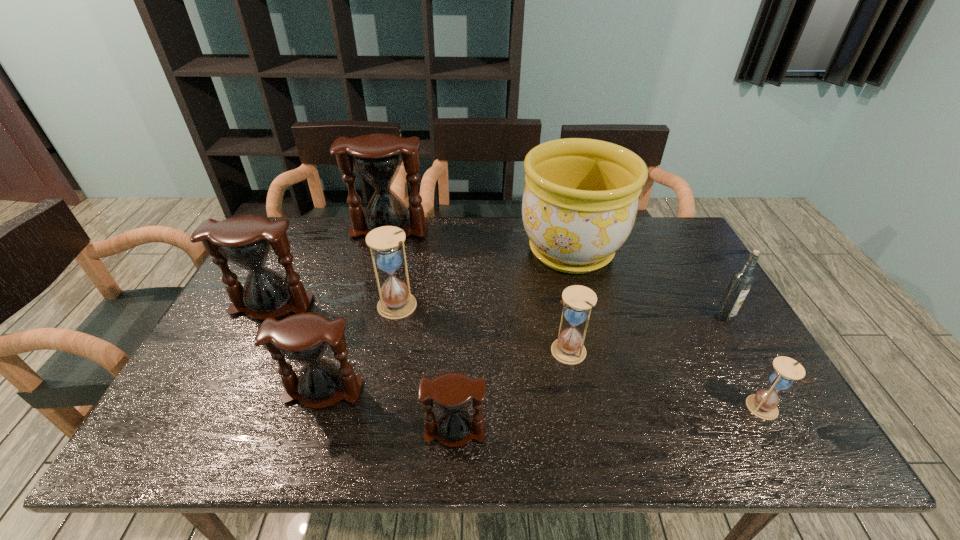
Identify the location of vacant space at the far edge of the desktop. (335, 219).

You are a GUI agent. You are given a task and a screenshot of the screen. Output one action in this format:
    pyautogui.click(x=<x>, y=<y>)
    Task: Click on the free space at the near edge
    The width and height of the screenshot is (960, 540).
    Given the screenshot: What is the action you would take?
    pyautogui.click(x=417, y=434)

This screenshot has height=540, width=960. In the image, there is a desktop. Identify the location of vacant space at the left edge. (235, 394).

Find the location of `free space at the right edge of the desktop`. free space at the right edge of the desktop is located at coordinates (741, 349).

Locate an element on the screen. free space at the near right corner is located at coordinates [771, 436].

Where is `empty location between the second nearest white hourglass and the fifth object from right to left`? empty location between the second nearest white hourglass and the fifth object from right to left is located at coordinates (512, 391).

At what (x,y) coordinates should I click in order to perform the action: click on free space between the second nearest brown hourglass and the flowerpot. Please return your answer as a coordinate pair (x, y). The width and height of the screenshot is (960, 540). Looking at the image, I should click on (447, 321).

I want to click on free space between the flowerpot and the leftmost brown hourglass, so click(x=421, y=278).

I want to click on vacant area that lies between the vodka and the rightmost brown hourglass, so click(589, 374).

This screenshot has width=960, height=540. What are the coordinates of `vacant region between the rightmost hourglass and the second nearest brown hourglass` in the screenshot? It's located at (543, 400).